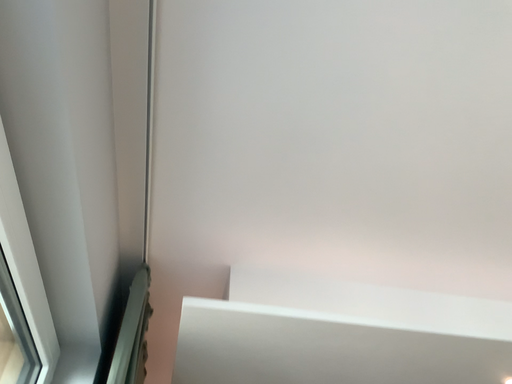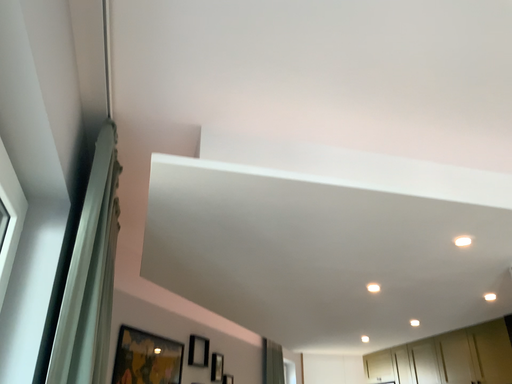
Question: How did the camera likely rotate when shooting the video?

Choices:
 (A) rotated upward
 (B) rotated downward

Answer: (B)